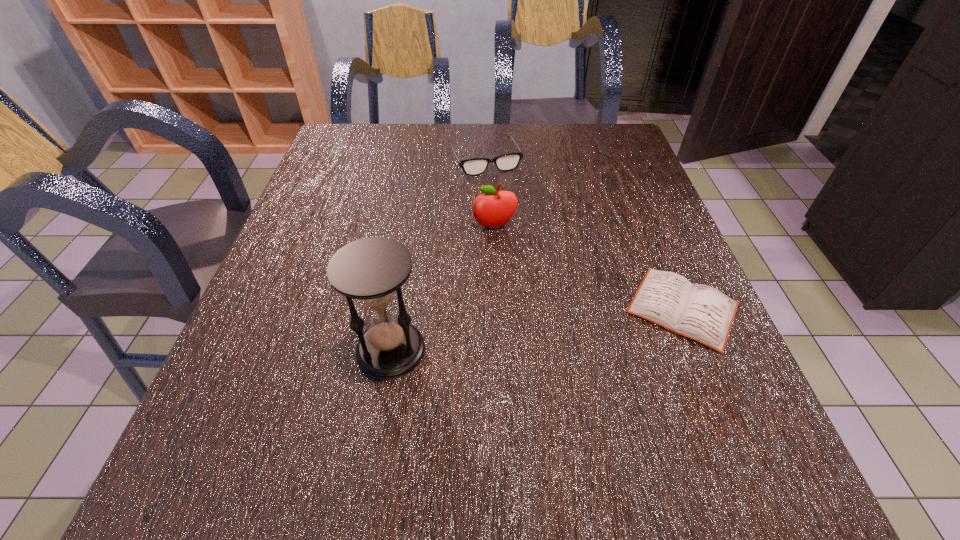
Where is `vacant region at the left edge of the desktop`? The height and width of the screenshot is (540, 960). vacant region at the left edge of the desktop is located at coordinates (319, 361).

Find the location of a particular element. vacant space at the right edge of the desktop is located at coordinates (615, 255).

Locate an element on the screen. This screenshot has width=960, height=540. free space at the far left corner is located at coordinates (352, 159).

Locate an element on the screen. Image resolution: width=960 pixels, height=540 pixels. free region at the far right corner is located at coordinates (583, 143).

What are the coordinates of `vacant area between the hourglass and the rightmost object` in the screenshot? It's located at point(537,329).

Where is `free spot between the second tallest object and the diary`? The width and height of the screenshot is (960, 540). free spot between the second tallest object and the diary is located at coordinates (588, 267).

The width and height of the screenshot is (960, 540). Find the location of `free space between the diary and the third shortest object`. free space between the diary and the third shortest object is located at coordinates (588, 267).

Where is `free spot between the tallest object and the diary`? This screenshot has height=540, width=960. free spot between the tallest object and the diary is located at coordinates (537, 329).

Find the location of a particular element. The height and width of the screenshot is (540, 960). empty space between the tallest object and the diary is located at coordinates (537, 329).

I want to click on free space between the rightmost object and the tallest object, so click(x=537, y=329).